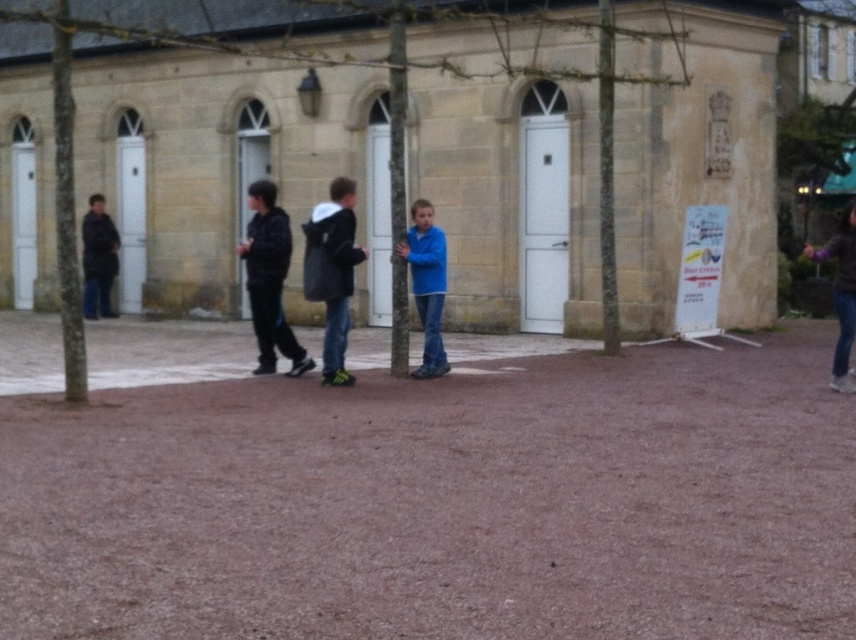
Question: Estimate the real-world distances between objects in this image. Which object is closer to the smooth bark tree at center?

Choices:
 (A) dark brown leather jacket at left
 (B) blue matte jacket at center

Answer: (B)

Question: Is smooth bark tree at center above black hoodie at center?

Choices:
 (A) no
 (B) yes

Answer: (B)

Question: Which point is closer to the camera?

Choices:
 (A) smooth bark tree at center
 (B) dark brown leather jacket at left
 (C) blue matte jacket at center
 (D) black hoodie at center

Answer: (A)

Question: Does blue matte jacket at center have a smaller size compared to dark brown leather jacket at left?

Choices:
 (A) no
 (B) yes

Answer: (B)

Question: Which point appears closest to the camera in this image?

Choices:
 (A) (415, 305)
 (B) (102, 269)
 (C) (566, 74)
 (D) (268, 266)

Answer: (D)

Question: Is blue matte jacket at center thinner than dark brown leather jacket at left?

Choices:
 (A) no
 (B) yes

Answer: (B)